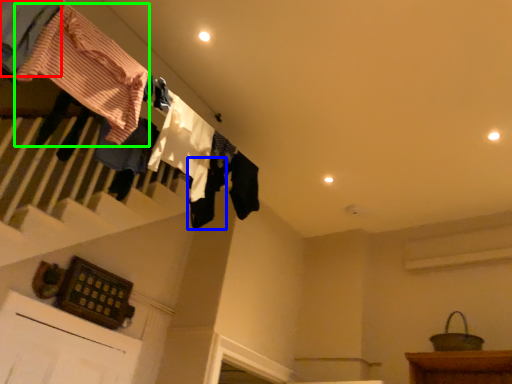
Question: Based on their relative distances, which object is nearer to clothing (highlighted by a red box)? Choose from clothing (highlighted by a blue box) and clothing (highlighted by a green box).

Choices:
 (A) clothing
 (B) clothing

Answer: (B)